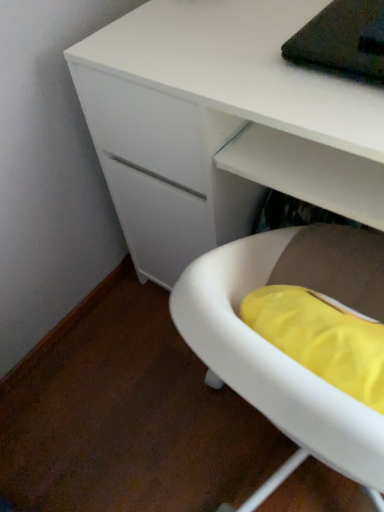
This screenshot has height=512, width=384. Describe the element at coordinates (280, 351) in the screenshot. I see `white plastic tub at lower right` at that location.

I want to click on white plastic tub at lower right, so click(x=280, y=351).

Find the location of a particular element. The height and width of the screenshot is (512, 384). white matte desk at center is located at coordinates (220, 125).

The height and width of the screenshot is (512, 384). What do you see at coordinates (220, 125) in the screenshot?
I see `white matte desk at center` at bounding box center [220, 125].

Find the location of a particular element. This screenshot has width=384, height=512. white plastic tub at lower right is located at coordinates (280, 351).

Is white matte desk at center to the right of white plastic tub at lower right from the viewer's perspective?

Yes.

From the picture: Considering the positions of objects white matte desk at center and white plastic tub at lower right in the image provided, who is in front, white matte desk at center or white plastic tub at lower right?

white plastic tub at lower right is more forward.

Which is behind, point (106, 63) or point (244, 362)?

Point (106, 63)

From the image's perspective, relative to white plastic tub at lower right, is white matte desk at center above or below?

Clearly, from the image's perspective, white matte desk at center is above white plastic tub at lower right.

From a real-world perspective, is white matte desk at center positioned under white plastic tub at lower right based on gravity?

Yes.

Between white matte desk at center and white plastic tub at lower right, which one has smaller width?

Thinner between the two is white plastic tub at lower right.

Between white matte desk at center and white plastic tub at lower right, which one has less height?

With less height is white plastic tub at lower right.

Considering the relative sizes of white matte desk at center and white plastic tub at lower right in the image provided, is white matte desk at center bigger than white plastic tub at lower right?

Yes.

Is white matte desk at center surrounding white plastic tub at lower right?

That's incorrect, white plastic tub at lower right is not inside white matte desk at center.

Would you say white matte desk at center is a long distance from white plastic tub at lower right?

No, white matte desk at center is not far away from white plastic tub at lower right.

Could you tell me if white matte desk at center is facing white plastic tub at lower right?

Yes, white matte desk at center is turned towards white plastic tub at lower right.

This screenshot has height=512, width=384. I want to click on furniture in front of the white matte desk at center, so click(x=280, y=351).

Which object is positioned more to the left, white plastic tub at lower right or white matte desk at center?

white plastic tub at lower right is more to the left.

In the image, is white plastic tub at lower right positioned in front of or behind white matte desk at center?

Visually, white plastic tub at lower right is located in front of white matte desk at center.

Which point is more forward, (342, 418) or (313, 120)?

The point (342, 418) is closer to the camera.

From the image's perspective, who appears lower, white plastic tub at lower right or white matte desk at center?

white plastic tub at lower right appears lower in the image.

From a real-world perspective, is white plastic tub at lower right positioned above or below white matte desk at center?

Clearly, from a real-world perspective, white plastic tub at lower right is above white matte desk at center.

Is white plastic tub at lower right thinner than white matte desk at center?

Correct, the width of white plastic tub at lower right is less than that of white matte desk at center.

Between white plastic tub at lower right and white matte desk at center, which one has more height?

With more height is white matte desk at center.

Based on their sizes in the image, would you say white plastic tub at lower right is bigger or smaller than white matte desk at center?

Considering their sizes, white plastic tub at lower right takes up less space than white matte desk at center.

Do you think white plastic tub at lower right is within white matte desk at center, or outside of it?

The correct answer is: outside.

Is white plastic tub at lower right beside white matte desk at center?

white plastic tub at lower right and white matte desk at center are not in contact.

Is white matte desk at center at the back of white plastic tub at lower right?

No, white plastic tub at lower right is not facing the opposite direction of white matte desk at center.

How many degrees apart are the facing directions of white plastic tub at lower right and white matte desk at center?

They differ by 180 degrees in their facing directions.

The height and width of the screenshot is (512, 384). Identify the location of desk beneath the white plastic tub at lower right (from a real-world perspective). 220,125.

Image resolution: width=384 pixels, height=512 pixels. Find the location of `desk that is behind the white plastic tub at lower right`. desk that is behind the white plastic tub at lower right is located at coordinates (220, 125).

Identify the location of desk that is on the right side of white plastic tub at lower right. This screenshot has width=384, height=512. (220, 125).